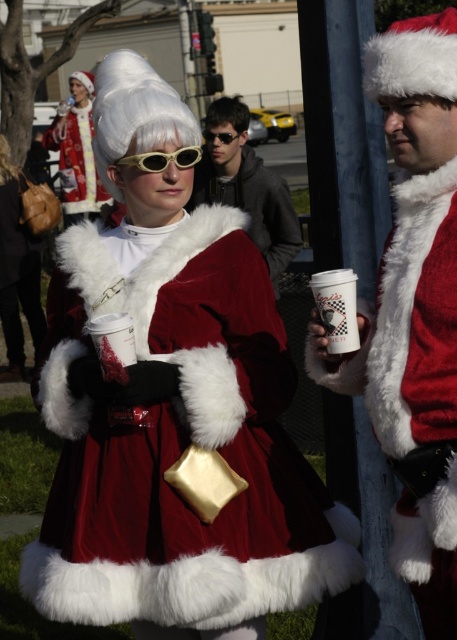
Question: Which is farther from the velvet red dress at center?

Choices:
 (A) velvet santa coat at center
 (B) matte black cup at center

Answer: (B)

Question: Is velvet santa suit at center bigger than white fluffy wig at center?

Choices:
 (A) no
 (B) yes

Answer: (B)

Question: Can you confirm if matte black cup at center is positioned above velvet santa suit at center?

Choices:
 (A) no
 (B) yes

Answer: (A)

Question: Can you confirm if matte black cup at center is thinner than velvet santa suit at center?

Choices:
 (A) no
 (B) yes

Answer: (B)

Question: Which is nearer to the matte black cup at center?

Choices:
 (A) velvet santa suit at center
 (B) matte gray hoodie at center
 (C) white fluffy wig at center

Answer: (C)

Question: Which point is closer to the camera?

Choices:
 (A) yellowmattegoggles at center
 (B) white paper cup at center
 (C) matte black cup at center
 (D) velvet red dress at center

Answer: (B)